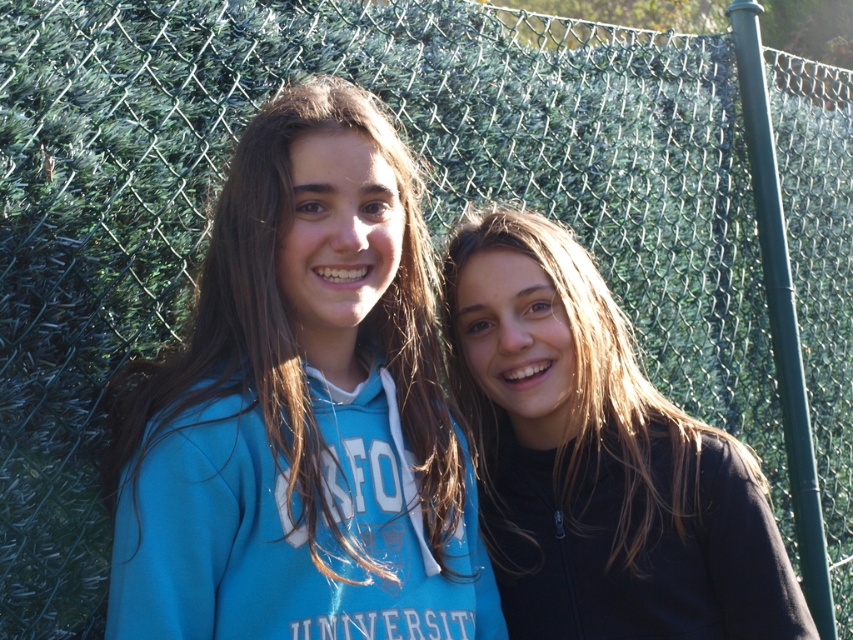
Question: Which is farther from the black fleece sweatshirt at right?

Choices:
 (A) blue fleece sweatshirt at center
 (B) black matte jacket at right

Answer: (A)

Question: Does black matte jacket at right have a lesser width compared to black fleece sweatshirt at right?

Choices:
 (A) no
 (B) yes

Answer: (A)

Question: Considering the relative positions of black matte jacket at right and matte blue sweatshirt at center in the image provided, where is black matte jacket at right located with respect to matte blue sweatshirt at center?

Choices:
 (A) left
 (B) right

Answer: (B)

Question: Is black matte jacket at right below black fleece sweatshirt at right?

Choices:
 (A) yes
 (B) no

Answer: (B)

Question: Among these objects, which one is farthest from the camera?

Choices:
 (A) blue fleece sweatshirt at center
 (B) black matte jacket at right
 (C) matte blue sweatshirt at center

Answer: (B)

Question: Which point is closer to the camera taking this photo?

Choices:
 (A) (305, 621)
 (B) (241, 273)

Answer: (A)